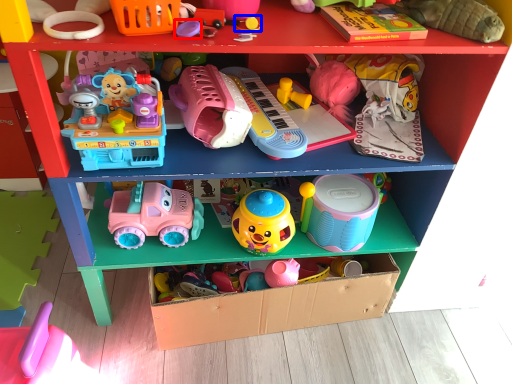
Question: Which object is further to the camera taking this photo, toy (highlighted by a red box) or toy (highlighted by a blue box)?

Choices:
 (A) toy
 (B) toy

Answer: (B)